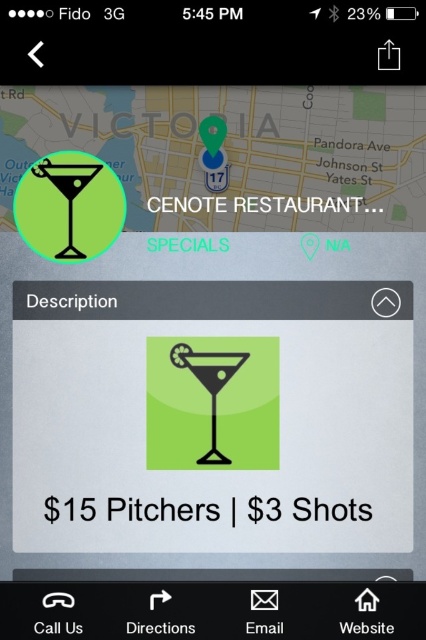
Does point (276, 198) lie behind point (213, 378)?

That is False.

Does green matte martini glass at upper left have a greater height compared to matte glass at center?

No, green matte martini glass at upper left is not taller than matte glass at center.

What do you see at coordinates (296, 204) in the screenshot?
I see `green matte martini glass at upper left` at bounding box center [296, 204].

Find the location of a particular element. The width and height of the screenshot is (426, 640). green matte martini glass at upper left is located at coordinates (296, 204).